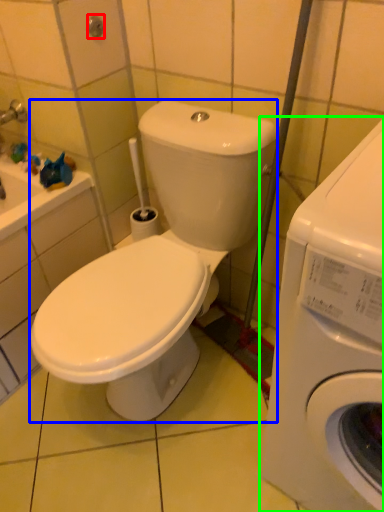
Question: Considering the real-world distances, which object is closest to shower (highlighted by a red box)? washing machine (highlighted by a blue box) or washing machine (highlighted by a green box).

Choices:
 (A) washing machine
 (B) washing machine

Answer: (A)